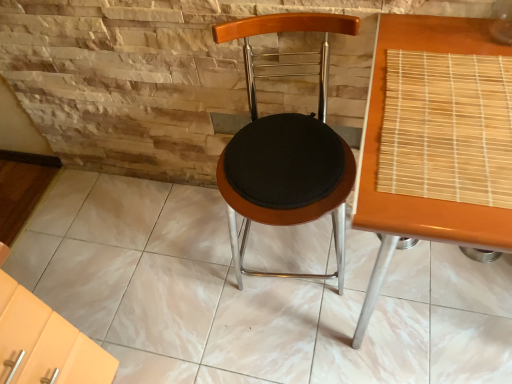
You are a GUI agent. You are given a task and a screenshot of the screen. Output one action in this format:
    pyautogui.click(x=<x>, y=<y>)
    Task: Click on the vacant space in woodenseat cushion at center (from a real-world perspective)
    The image size is (512, 384).
    Given the screenshot: What is the action you would take?
    pyautogui.click(x=287, y=266)